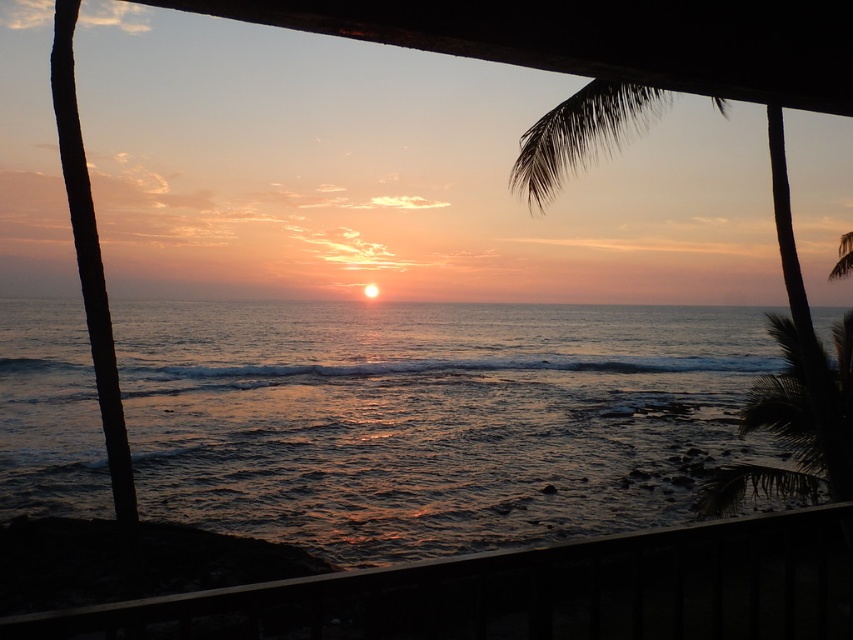
Question: Considering the relative positions of shiny blue water at center and smooth wooden railing at lower center in the image provided, where is shiny blue water at center located with respect to smooth wooden railing at lower center?

Choices:
 (A) above
 (B) below

Answer: (A)

Question: Is smooth wooden railing at lower center positioned behind green leafy palm tree at upper right?

Choices:
 (A) no
 (B) yes

Answer: (A)

Question: Among these objects, which one is nearest to the camera?

Choices:
 (A) green leafy palm tree at upper right
 (B) smooth wooden railing at lower center
 (C) shiny blue water at center

Answer: (B)

Question: Which object appears farthest from the camera in this image?

Choices:
 (A) shiny blue water at center
 (B) smooth wooden railing at lower center
 (C) green leafy palm tree at upper right

Answer: (A)

Question: Considering the real-world distances, which object is farthest from the green leafy palm tree at upper right?

Choices:
 (A) shiny blue water at center
 (B) smooth wooden railing at lower center

Answer: (A)

Question: Does shiny blue water at center lie in front of smooth wooden railing at lower center?

Choices:
 (A) yes
 (B) no

Answer: (B)